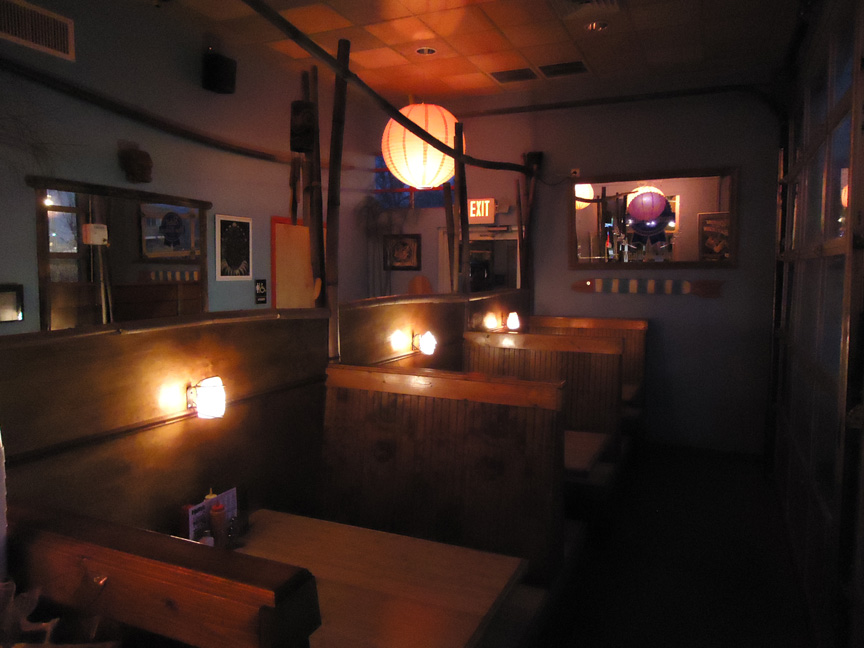
The image size is (864, 648). Identify the location of lights. (199, 404), (427, 164), (427, 334), (512, 315).